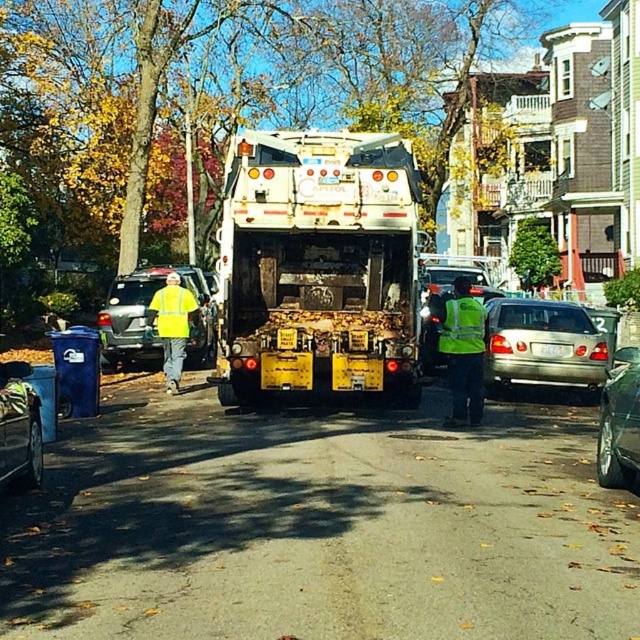
Is white matte garbage truck at center to the right of yellow reflective vest at center from the viewer's perspective?

Yes, white matte garbage truck at center is to the right of yellow reflective vest at center.

Can you confirm if white matte garbage truck at center is positioned below yellow reflective vest at center?

Indeed, white matte garbage truck at center is positioned under yellow reflective vest at center.

Does point (406, 362) come behind point (180, 301)?

No, it is in front of (180, 301).

Identify the location of white matte garbage truck at center. This screenshot has width=640, height=640. (317, 266).

Does point (333, 227) come behind point (614, 406)?

Yes, it is.

Who is lower down, white matte garbage truck at center or shiny metallic car at right?

shiny metallic car at right

Between point (408, 253) and point (616, 438), which one is positioned in front?

Positioned in front is point (616, 438).

This screenshot has width=640, height=640. In order to click on white matte garbage truck at center in this screenshot , I will do `click(317, 266)`.

Does silver metallic sedan at center have a greater height compared to yellow reflective vest at left?

Yes, silver metallic sedan at center is taller than yellow reflective vest at left.

Is point (531, 314) positioned before point (120, 355)?

Yes.

The image size is (640, 640). What do you see at coordinates (544, 344) in the screenshot? I see `silver metallic sedan at center` at bounding box center [544, 344].

I want to click on silver metallic sedan at center, so click(x=544, y=344).